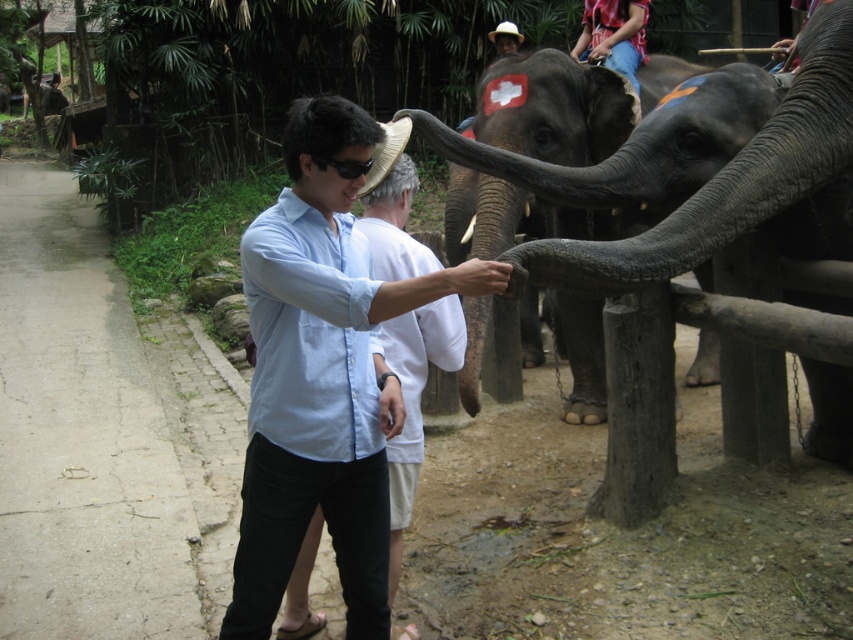
You are a safety officer at the sanctuary. You need to ensure that visitors maintain a minimum distance of 5 feet from the elephants for safety. Based on the image, is the person in the light blue shirt at center violating the safety guidelines when interacting with the gray textured elephant trunk at center?

The distance between the light blue shirt at center and the gray textured elephant trunk at center is 4.72 feet, which is less than the required 5 feet. Therefore, the person in the light blue shirt at center is violating the safety guidelines by being too close to the gray textured elephant trunk at center.

You are standing at the point labeled point (335, 497) and want to walk to the point labeled point (712, 113). Which direction should you face to walk straight towards your destination?

You should face north to walk straight towards point (712, 113) from point (335, 497).

You are a photographer trying to capture a clear photo of the light blue shirt at center and the gray textured elephant trunk at center. Which object should you focus on first to ensure both are in focus?

You should focus on the light blue shirt at center first because it is closer to the viewer than the gray textured elephant trunk at center. By focusing on the closer object, the trunk will also be in focus due to the depth of field.